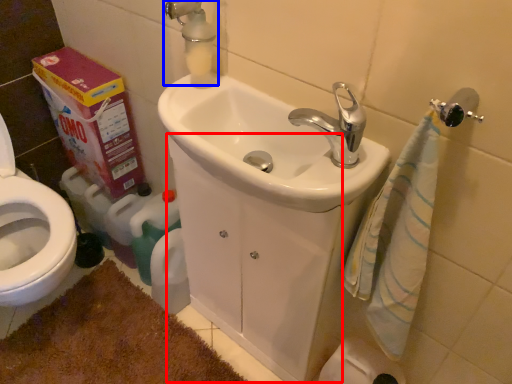
Question: Which point is closer to the camera, porcelain (highlighted by a red box) or plumbing fixture (highlighted by a blue box)?

Choices:
 (A) porcelain
 (B) plumbing fixture

Answer: (A)